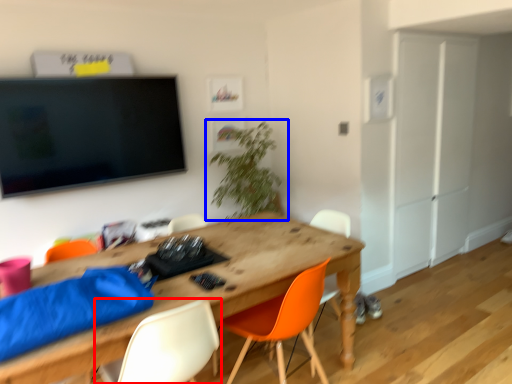
Question: Which object appears closest to the camera in this image, chair (highlighted by a red box) or houseplant (highlighted by a blue box)?

Choices:
 (A) chair
 (B) houseplant

Answer: (A)